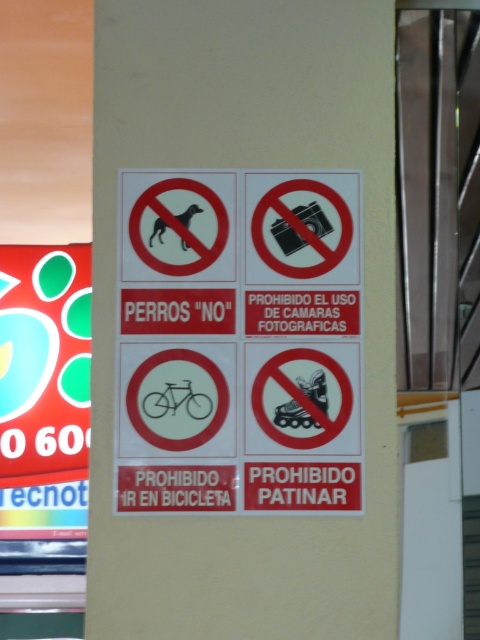
Between point (239, 456) and point (60, 436), which one is positioned in front?

Point (239, 456)

Between black paper sign at center and red glossy poster at left, which one is positioned higher?

Positioned higher is black paper sign at center.

This screenshot has width=480, height=640. I want to click on black paper sign at center, so point(239,340).